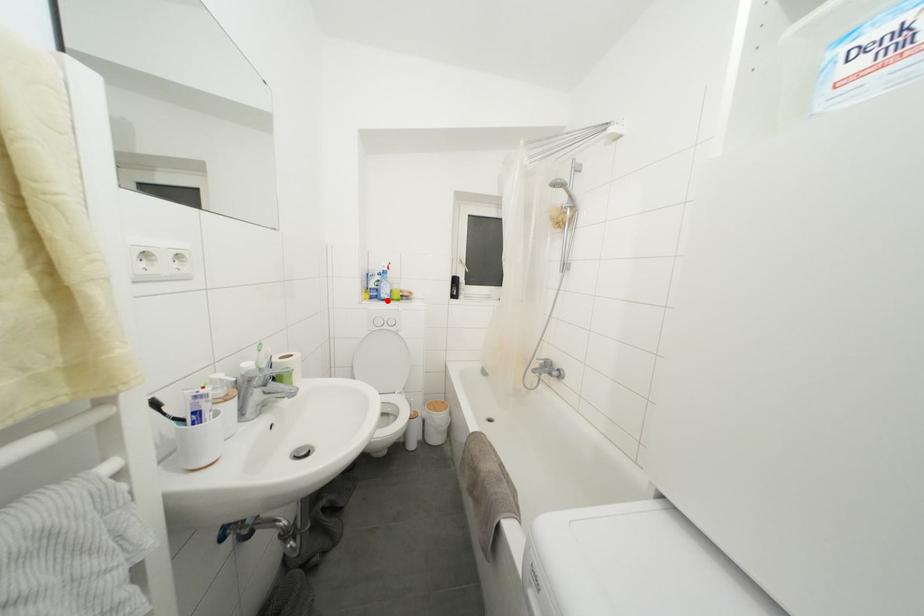
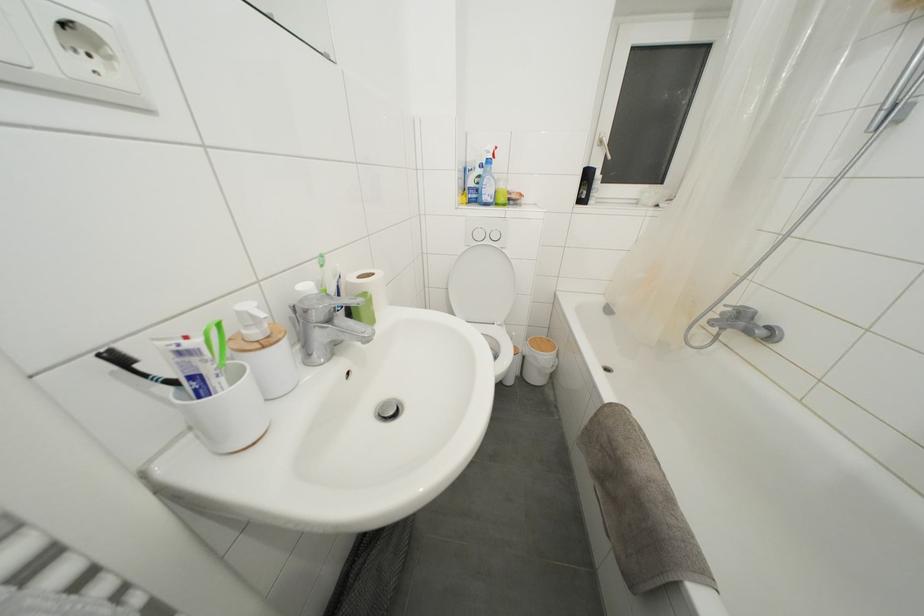
Question: I am providing you with two images of the same scene from different viewpoints. In image1, a red point is highlighted. Considering the same 3D point in image2, which of the following is correct?

Choices:
 (A) It is closer
 (B) It is farther

Answer: (A)